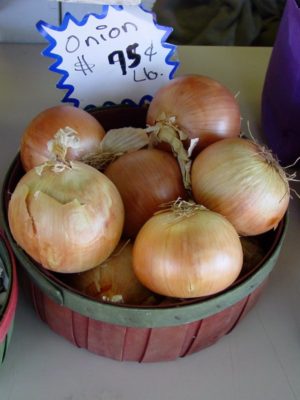
You are a GUI agent. You are given a task and a screenshot of the screen. Output one action in this format:
    pyautogui.click(x=<x>, y=<y>)
    Task: Click on the rim of basket
    The height and width of the screenshot is (400, 300).
    Given the screenshot: What is the action you would take?
    pyautogui.click(x=168, y=317)